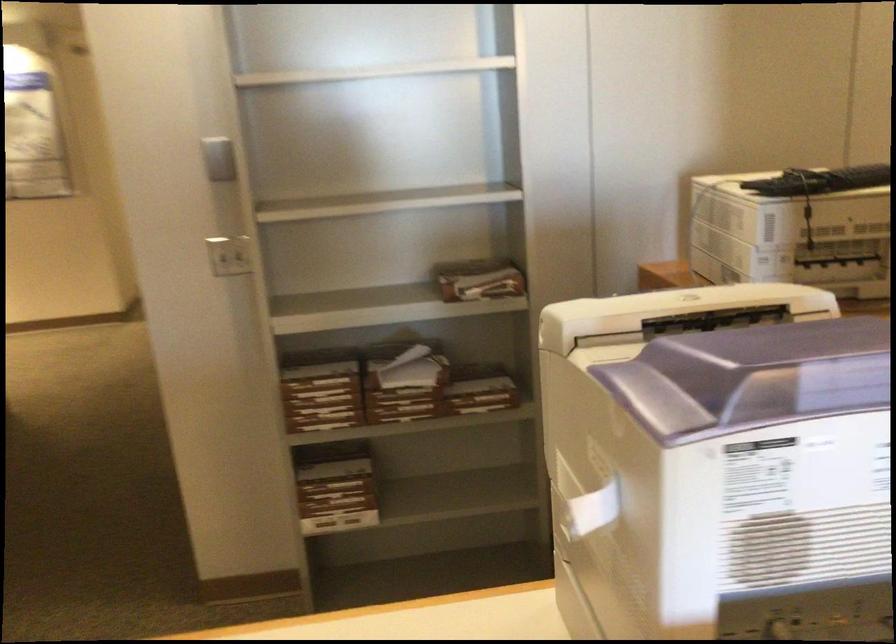
This screenshot has height=644, width=896. What do you see at coordinates (219, 158) in the screenshot?
I see `the white light switch` at bounding box center [219, 158].